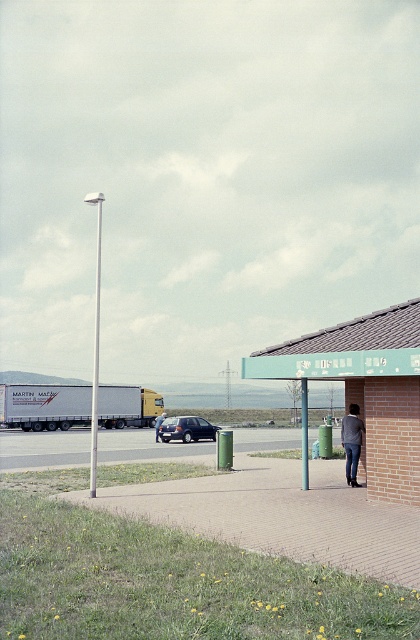
You are driving a car and want to park in the space between the green lamppost on the left and the small brick shelter on the right. The scene shows a smooth concrete pavement at center and a dark blue metallic hatchback at center. Can you fit your car into this space without hitting either the lamppost or the shelter?

The smooth concrete pavement at center is in front of the dark blue metallic hatchback at center, so the pavement is closer to you than the hatchback. This suggests that the parking space between the lamppost and the shelter is occupied by the hatchback. Therefore, you cannot fit your car into this space without displacing the existing vehicle.